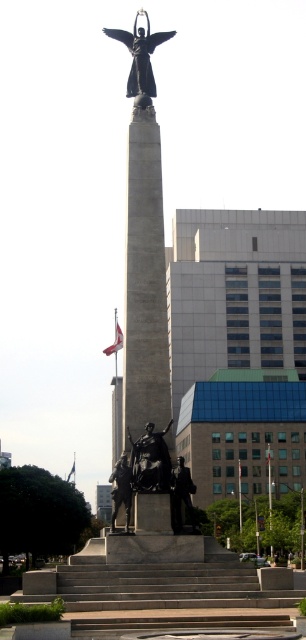
You are standing in front of the monument and want to take a photo of both the polished bronze statue at upper center and the bronze statue at center. Which statue should you focus on first to ensure both are in the frame?

You should focus on the polished bronze statue at upper center first because it is closer to you than the bronze statue at center, so adjusting the camera to include it will also capture the farther one.

You are an art student analyzing the monument. You notice two statues on the monument. One is the polished bronze statue at upper center and the other is the bronze statue at center. Which of these two statues is shorter?

The polished bronze statue at upper center is shorter than the bronze statue at center.

From the picture: You are an art student analyzing the monument. You notice two statues on the monument. The polished bronze statue at upper center and the bronze statue at center. Which one takes up more space in the monument?

The bronze statue at center takes up more space than the polished bronze statue at upper center because the polished bronze statue at upper center occupies less space than bronze statue at center.